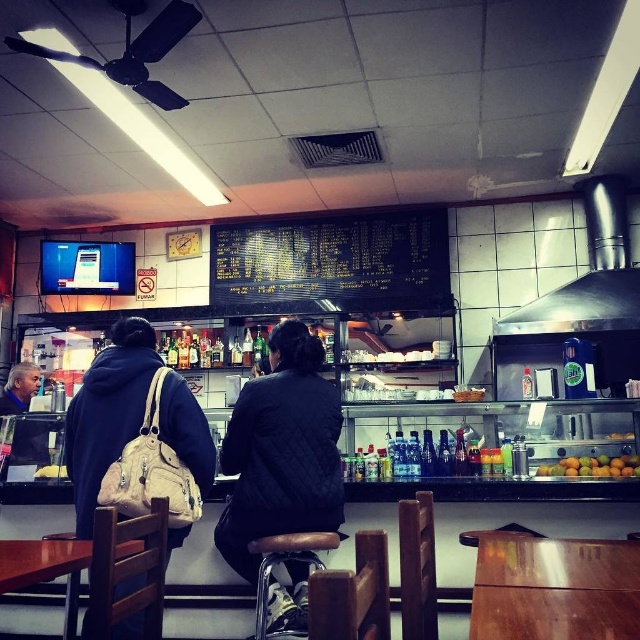
From the picture: Who is more distant from viewer, [576,627] or [8,563]?

Positioned behind is point [8,563].

Who is taller, wooden table at center or brown wooden table at lower left?

wooden table at center

Does point (518, 620) lie behind point (129, 541)?

No.

Where is `wooden table at center`? This screenshot has height=640, width=640. wooden table at center is located at coordinates (554, 588).

Between dark blue quilted jacket at center and brown wooden table at lower left, which one is positioned higher?

A: dark blue quilted jacket at center is above.

Can you confirm if dark blue quilted jacket at center is bigger than brown wooden table at lower left?

Yes, dark blue quilted jacket at center is bigger than brown wooden table at lower left.

At what (x,y) coordinates should I click in order to perform the action: click on dark blue quilted jacket at center. Please return your answer as a coordinate pair (x, y). Looking at the image, I should click on (284, 442).

The width and height of the screenshot is (640, 640). Find the location of `dark blue quilted jacket at center`. dark blue quilted jacket at center is located at coordinates 284,442.

The image size is (640, 640). What do you see at coordinates (282, 451) in the screenshot? I see `black quilted jacket at center` at bounding box center [282, 451].

Between point (244, 385) and point (67, 604), which one is positioned in front?

Point (244, 385) is in front.

Who is more distant from viewer, (296, 394) or (67, 573)?

Point (67, 573)

Where is `black quilted jacket at center`? The width and height of the screenshot is (640, 640). black quilted jacket at center is located at coordinates [282, 451].